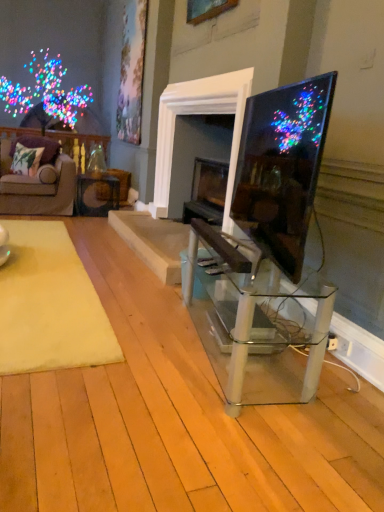
This screenshot has height=512, width=384. What are the coordinates of `vacant space situated on the left part of clear glass table at center, positioned as the 2th table in back-to-front order` in the screenshot? It's located at (137, 343).